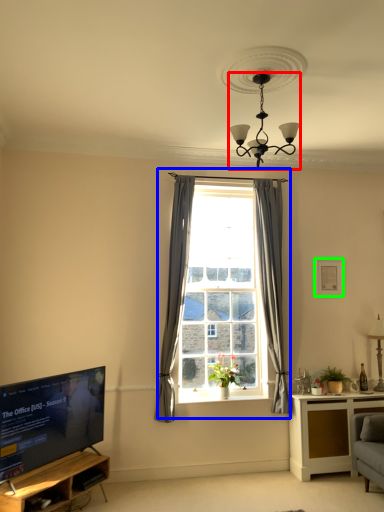
Question: Estimate the real-world distances between objects in this image. Which object is farther from light fixture (highlighted by a red box), window (highlighted by a blue box) or picture frame (highlighted by a green box)?

Choices:
 (A) window
 (B) picture frame

Answer: (B)